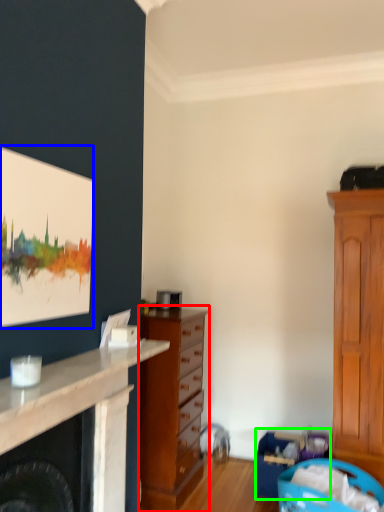
Question: Considering the real-world distances, which object is farthest from chest of drawers (highlighted by a red box)? picture frame (highlighted by a blue box) or laundry basket (highlighted by a green box)?

Choices:
 (A) picture frame
 (B) laundry basket

Answer: (A)